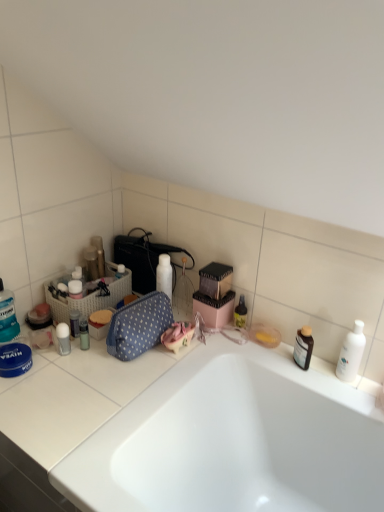
Find the location of a particular element. Image resolution: width=384 pixels, height=512 pixels. vacant area to the left of metallic silver container at left, the 5th toiletry viewed from the left is located at coordinates (42, 358).